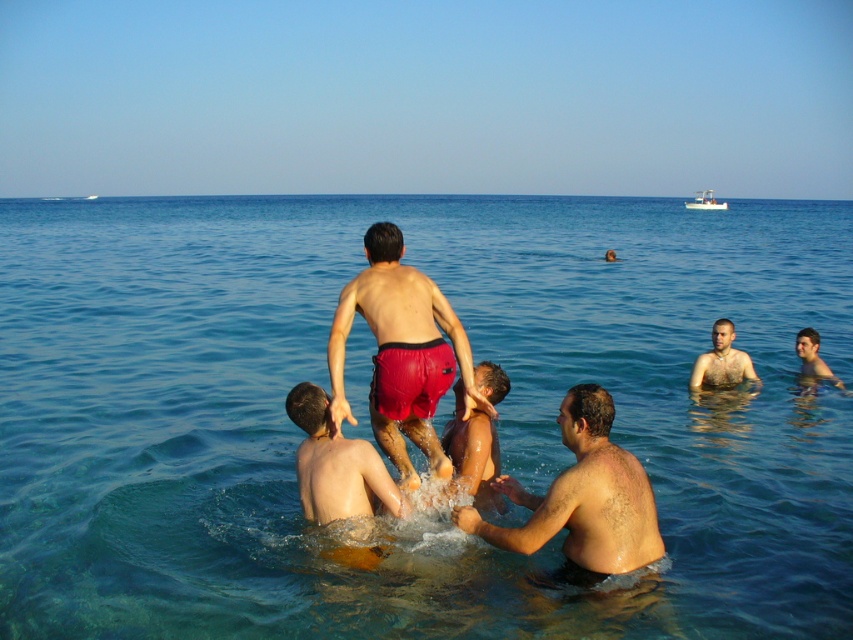
Can you confirm if smooth skin child at lower right is wider than white plastic boat at upper right?

In fact, smooth skin child at lower right might be narrower than white plastic boat at upper right.

Does smooth skin child at lower right appear under white plastic boat at upper right?

Yes.

You are a GUI agent. You are given a task and a screenshot of the screen. Output one action in this format:
    pyautogui.click(x=<x>, y=<y>)
    Task: Click on the smooth skin child at lower right
    The width and height of the screenshot is (853, 640).
    Given the screenshot: What is the action you would take?
    pyautogui.click(x=813, y=356)

Is matte red shorts at center to the left of smooth skin child at lower right from the viewer's perspective?

Indeed, matte red shorts at center is positioned on the left side of smooth skin child at lower right.

From the picture: Does matte red shorts at center lie in front of smooth skin child at lower right?

Yes, matte red shorts at center is closer to the viewer.

This screenshot has width=853, height=640. I want to click on matte red shorts at center, so click(x=401, y=355).

Is point (708, 365) in front of point (705, 189)?

Yes, it is in front of point (705, 189).

Is light brown skin at center smaller than white plastic boat at upper right?

Indeed, light brown skin at center has a smaller size compared to white plastic boat at upper right.

Find the location of a particular element. Image resolution: width=853 pixels, height=640 pixels. light brown skin at center is located at coordinates (721, 360).